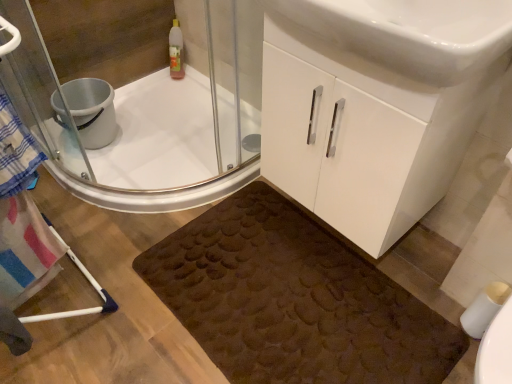
Question: In terms of size, does silver metallic bucket at upper left appear bigger or smaller than white glossy sink at center?

Choices:
 (A) small
 (B) big

Answer: (A)

Question: In terms of height, does silver metallic bucket at upper left look taller or shorter compared to white glossy sink at center?

Choices:
 (A) short
 (B) tall

Answer: (A)

Question: Which is nearer to the white matte toilet paper at lower right?

Choices:
 (A) white glossy sink at center
 (B) brown textured bath mat at lower center
 (C) clear glass shower door at upper left
 (D) white glossy cabinet at center
 (E) silver metallic bucket at upper left

Answer: (B)

Question: Based on their relative distances, which object is farther from the white glossy cabinet at center?

Choices:
 (A) white glossy sink at center
 (B) clear glass shower door at upper left
 (C) brown textured bath mat at lower center
 (D) white matte toilet paper at lower right
 (E) silver metallic bucket at upper left

Answer: (E)